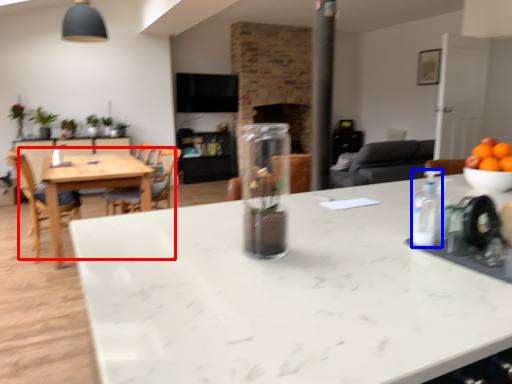
Question: Which object appears closest to the camera in this image, kitchen & dining room table (highlighted by a red box) or bottle (highlighted by a blue box)?

Choices:
 (A) kitchen & dining room table
 (B) bottle

Answer: (B)